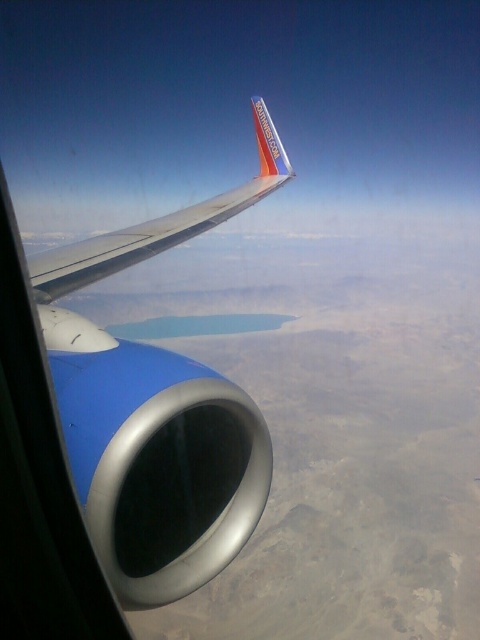
Is metallic blue engine at center above metallic silver wing at center?

Incorrect, metallic blue engine at center is not positioned above metallic silver wing at center.

Between point (151, 586) and point (94, 241), which one is positioned behind?

The point (94, 241) is behind.

Find the location of `metallic blue engine at center`. metallic blue engine at center is located at coordinates (156, 413).